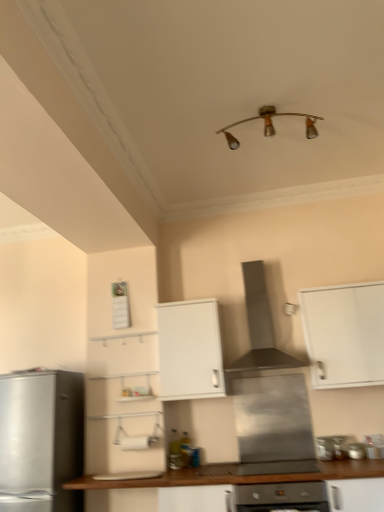
Find the location of `free space to the left of metallic silver stove at lower center, which is the 2th appliance from right to left`. free space to the left of metallic silver stove at lower center, which is the 2th appliance from right to left is located at coordinates (303, 461).